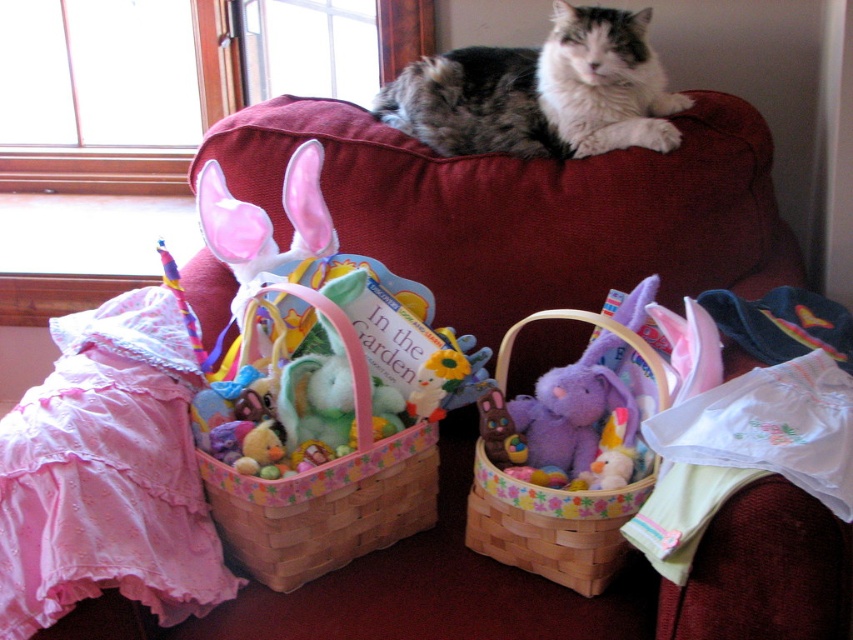
Between point (486, 51) and point (590, 528), which one is positioned in front?

Point (590, 528) is in front.

Identify the location of gray and white fur cat at center. This screenshot has width=853, height=640. (541, 92).

Locate an element on the screen. gray and white fur cat at center is located at coordinates (541, 92).

Image resolution: width=853 pixels, height=640 pixels. What do you see at coordinates (326, 486) in the screenshot?
I see `pastel woven basket at center left` at bounding box center [326, 486].

Between pastel woven basket at center left and wooden woven basket at center, which one appears on the right side from the viewer's perspective?

From the viewer's perspective, wooden woven basket at center appears more on the right side.

The image size is (853, 640). Describe the element at coordinates (326, 486) in the screenshot. I see `pastel woven basket at center left` at that location.

Where is `pastel woven basket at center left`? Image resolution: width=853 pixels, height=640 pixels. pastel woven basket at center left is located at coordinates (326, 486).

Can you confirm if velvet couch at upper center is smaller than wooden woven basket at center?

Incorrect, velvet couch at upper center is not smaller in size than wooden woven basket at center.

What do you see at coordinates (529, 209) in the screenshot? The image size is (853, 640). I see `velvet couch at upper center` at bounding box center [529, 209].

You are a GUI agent. You are given a task and a screenshot of the screen. Output one action in this format:
    pyautogui.click(x=<x>, y=<y>)
    Task: Click on the velvet couch at upper center
    
    Given the screenshot: What is the action you would take?
    pyautogui.click(x=529, y=209)